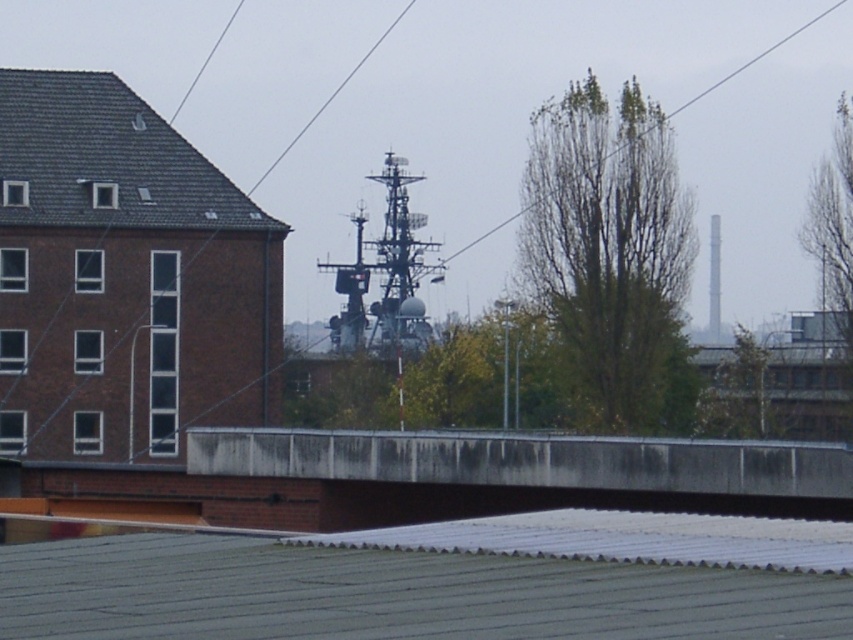
Question: Does green corrugated metal roof at lower center have a greater width compared to transparent wire at upper center?

Choices:
 (A) yes
 (B) no

Answer: (B)

Question: Which of the following is the closest to the observer?

Choices:
 (A) transparent wire at upper center
 (B) green corrugated metal roof at lower center

Answer: (B)

Question: Where is metallic gray ship at center located in relation to metallic wire at upper center in the image?

Choices:
 (A) below
 (B) above

Answer: (A)

Question: Can you confirm if dark gray shingles at upper left is positioned below transparent wire at upper center?

Choices:
 (A) no
 (B) yes

Answer: (B)

Question: Which of these objects is positioned farthest from the dark gray shingles at upper left?

Choices:
 (A) metallic gray ship at center
 (B) green corrugated metal roof at lower center

Answer: (B)

Question: Based on their relative distances, which object is nearer to the green corrugated metal roof at lower center?

Choices:
 (A) metallic gray ship at center
 (B) metallic wire at upper center
 (C) dark gray shingles at upper left

Answer: (C)